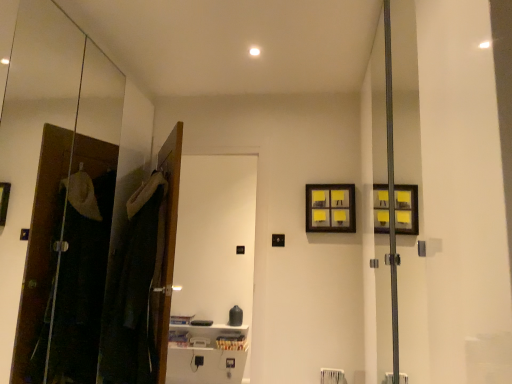
Question: Would you say yellow paper at upper right is inside or outside dark fabric laundry at left?

Choices:
 (A) inside
 (B) outside

Answer: (B)

Question: In terms of size, does yellow paper at upper right appear bigger or smaller than dark fabric laundry at left?

Choices:
 (A) small
 (B) big

Answer: (A)

Question: Considering the real-world distances, which object is closest to the yellow paper at upper right?

Choices:
 (A) white glossy screen door at center
 (B) dark fabric laundry at left

Answer: (B)

Question: Estimate the real-world distances between objects in this image. Which object is closer to the white glossy screen door at center?

Choices:
 (A) dark fabric laundry at left
 (B) yellow paper at upper right

Answer: (B)